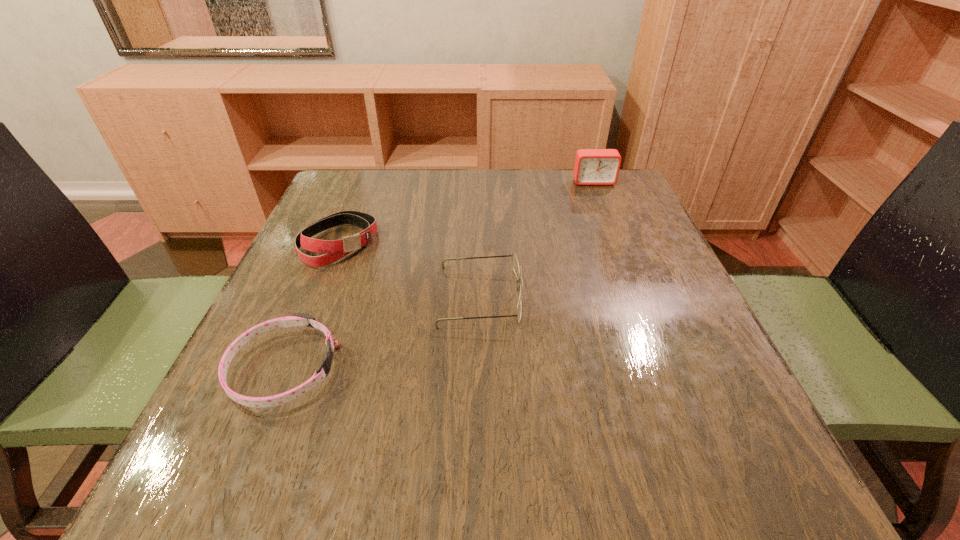
Identify the location of the second closest object to the spectacles. (298, 319).

The image size is (960, 540). Identify the location of free spot that satisfies the following two spatial constraints: 1. on the front-facing side of the rightmost object; 2. on the front-facing side of the spectacles. (638, 296).

Identify the location of free space that satisfies the following two spatial constraints: 1. on the front-facing side of the alarm clock; 2. on the front-facing side of the second object from right to left. (638, 296).

Locate an element on the screen. Image resolution: width=960 pixels, height=540 pixels. free spot that satisfies the following two spatial constraints: 1. on the front side of the farther dog collar; 2. with the buckle on the shorter dog collar is located at coordinates (288, 369).